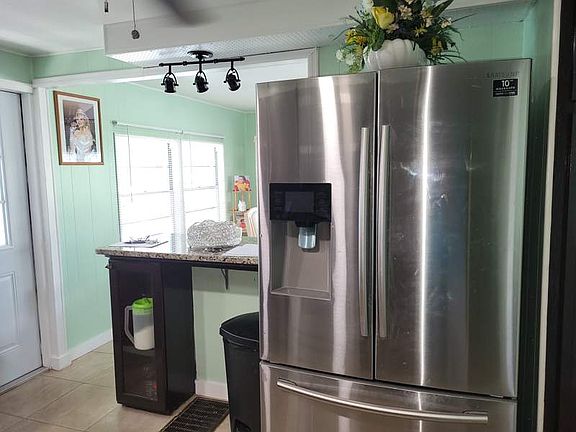
The height and width of the screenshot is (432, 576). Identify the location of handle. (366, 400).